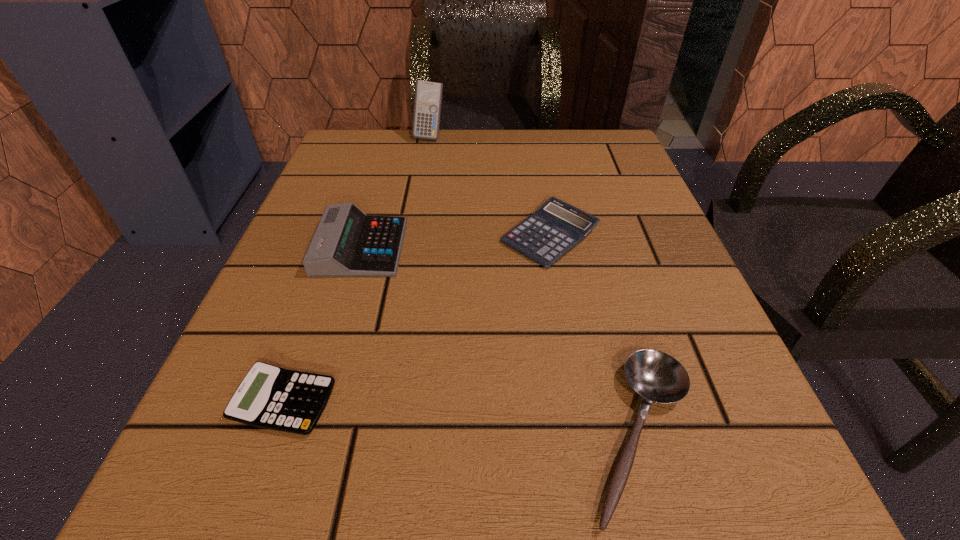
The width and height of the screenshot is (960, 540). What are the coordinates of `vacant space at the far left corner of the desktop` in the screenshot? It's located at (345, 165).

At what (x,y) coordinates should I click in order to perform the action: click on vacant region at the near left corner. Please return your answer as a coordinate pair (x, y). Looking at the image, I should click on (233, 476).

I want to click on vacant space at the far right corner, so click(x=606, y=161).

Where is `vacant space at the near right corner of the desktop`? This screenshot has width=960, height=540. vacant space at the near right corner of the desktop is located at coordinates (800, 523).

This screenshot has height=540, width=960. In order to click on free space between the rightmost calculator and the second tallest calculator in this screenshot , I will do `click(455, 241)`.

Where is `empty space that is in between the farthest object and the rightmost calculator`? The height and width of the screenshot is (540, 960). empty space that is in between the farthest object and the rightmost calculator is located at coordinates (490, 186).

The image size is (960, 540). Find the location of `free space between the rightmost calculator and the ladle`. free space between the rightmost calculator and the ladle is located at coordinates pos(595,335).

At what (x,y) coordinates should I click in order to perform the action: click on vacant area that lies between the second tallest calculator and the farthest object. Please return your answer as a coordinate pair (x, y). The image size is (960, 540). Looking at the image, I should click on (396, 192).

Image resolution: width=960 pixels, height=540 pixels. In order to click on vacant area that lies between the nearest calculator and the rightmost calculator in this screenshot , I will do tap(418, 319).

Where is `vacant region between the ladle and the nearest calculator`? This screenshot has height=540, width=960. vacant region between the ladle and the nearest calculator is located at coordinates (463, 418).